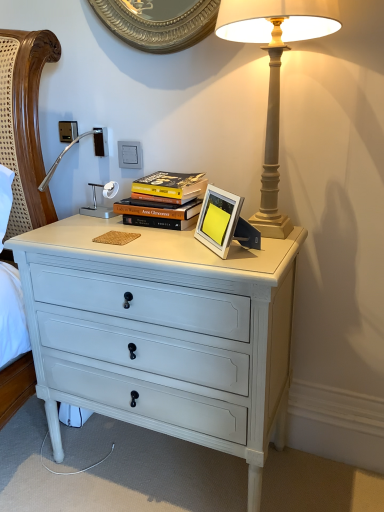
This screenshot has width=384, height=512. I want to click on vacant space to the right of silver metallic picture frame at center, so click(271, 247).